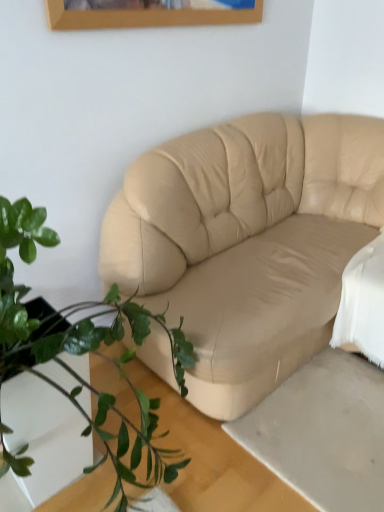
Question: From a real-world perspective, is green leafy plant at lower left physically located above or below beige leather couch at center?

Choices:
 (A) above
 (B) below

Answer: (A)

Question: Based on their sizes in the image, would you say green leafy plant at lower left is bigger or smaller than beige leather couch at center?

Choices:
 (A) small
 (B) big

Answer: (A)

Question: Considering their positions, is green leafy plant at lower left located in front of or behind beige leather couch at center?

Choices:
 (A) front
 (B) behind

Answer: (A)

Question: In terms of size, does beige leather couch at center appear bigger or smaller than green leafy plant at lower left?

Choices:
 (A) big
 (B) small

Answer: (A)

Question: Is beige leather couch at center situated inside green leafy plant at lower left or outside?

Choices:
 (A) inside
 (B) outside

Answer: (B)

Question: Considering their positions, is beige leather couch at center located in front of or behind green leafy plant at lower left?

Choices:
 (A) behind
 (B) front

Answer: (A)

Question: Does point (307, 285) appear closer or farther from the camera than point (6, 288)?

Choices:
 (A) farther
 (B) closer

Answer: (A)